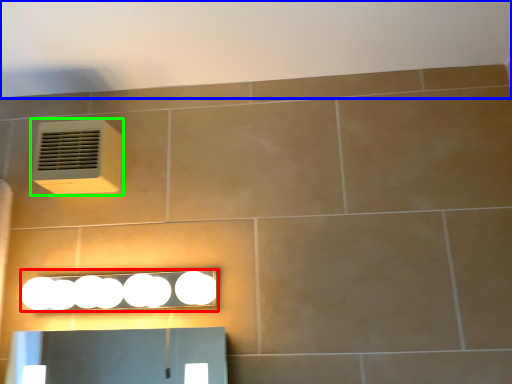
Question: Which object is positioned farthest from light fixture (highlighted by a red box)? Select from backdrop (highlighted by a blue box) and air conditioning (highlighted by a green box).

Choices:
 (A) backdrop
 (B) air conditioning

Answer: (A)